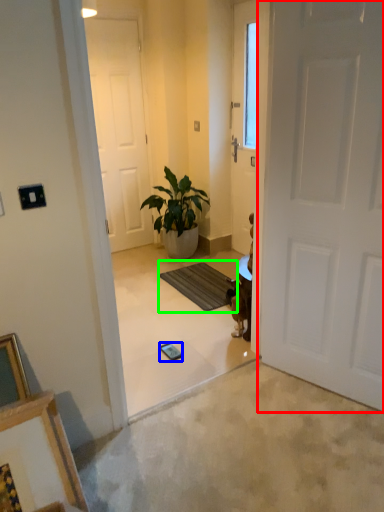
Question: Estimate the real-world distances between objects in this image. Which object is closer to door (highlighted by a red box), mobile phone (highlighted by a blue box) or doormat (highlighted by a green box)?

Choices:
 (A) mobile phone
 (B) doormat

Answer: (A)